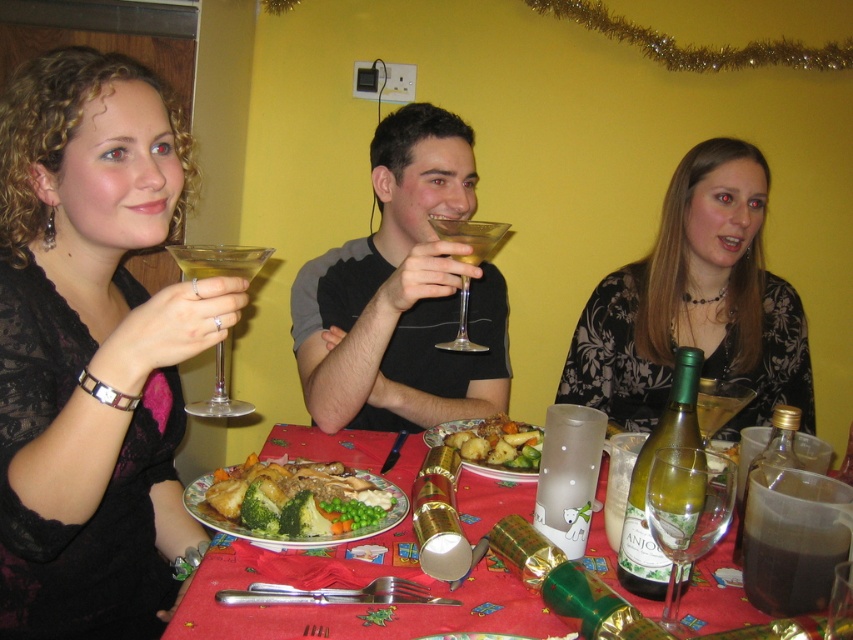
Question: Can you confirm if dark matte pitcher at lower right is positioned to the right of green translucent wine glass at center?

Choices:
 (A) yes
 (B) no

Answer: (A)

Question: Based on their relative distances, which object is nearer to the green glass bottle at center?

Choices:
 (A) transparent glass martini glass at left
 (B) golden brown roasted chicken at center
 (C) matte plastic plate at center

Answer: (C)

Question: Is matte black dress at left positioned behind black floral dress at center?

Choices:
 (A) yes
 (B) no

Answer: (B)

Question: Does matte black dress at left appear on the right side of dark matte pitcher at lower right?

Choices:
 (A) no
 (B) yes

Answer: (A)

Question: Among these points, which one is farthest from the camera?

Choices:
 (A) (639, 561)
 (B) (444, 406)

Answer: (B)

Question: Which of the following is the farthest from the observer?

Choices:
 (A) (846, 499)
 (B) (728, 465)
 (C) (534, 433)
 (D) (664, 589)

Answer: (C)